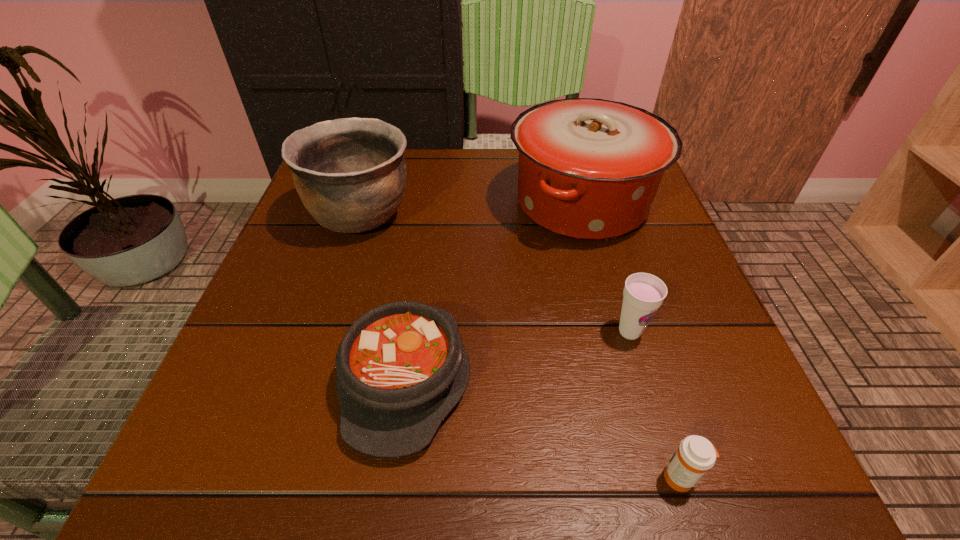
Locate an element on the screen. object identified as the second closest to the taller casserole is located at coordinates (401, 367).

Locate an element on the screen. This screenshot has height=540, width=960. free location that satisfies the following two spatial constraints: 1. on the front side of the third tallest object; 2. on the right side of the medicine is located at coordinates (674, 477).